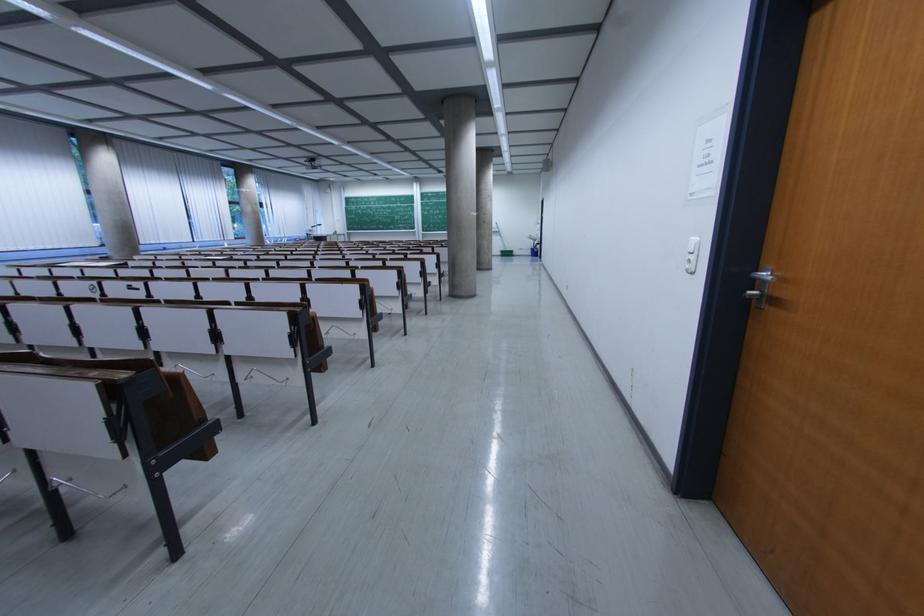
Find where to pull the metal door handle. Please return your answer as a coordinate pair (x, y).

(760, 286)